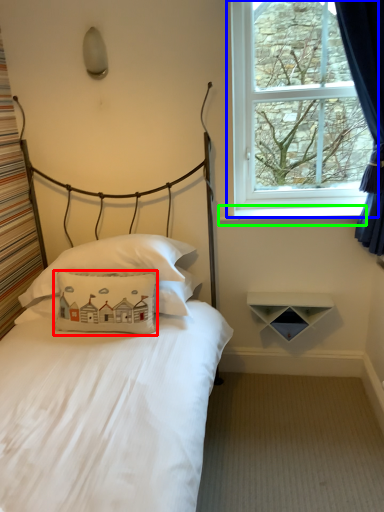
Question: Estimate the real-world distances between objects in this image. Which object is closer to pillow (highlighted by a red box), window (highlighted by a blue box) or window sill (highlighted by a green box)?

Choices:
 (A) window
 (B) window sill

Answer: (B)